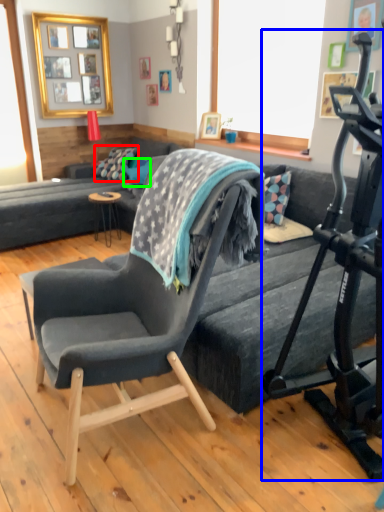
Question: Which is nearer to the pillow (highlighted by a red box)? treadmill (highlighted by a blue box) or pillow (highlighted by a green box).

Choices:
 (A) treadmill
 (B) pillow

Answer: (B)